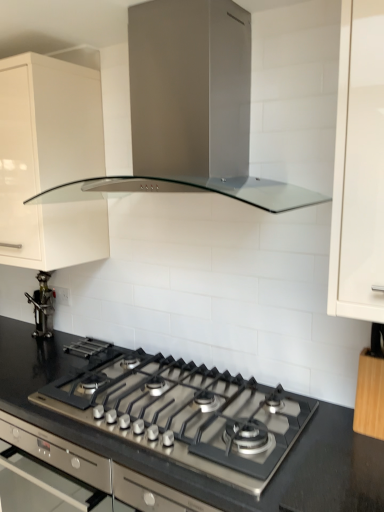
Question: Should I look upward or downward to see black granite countertop at center?

Choices:
 (A) down
 (B) up

Answer: (A)

Question: Could you tell me if satin silver oven at center is turned towards black granite countertop at center?

Choices:
 (A) yes
 (B) no

Answer: (B)

Question: Is satin silver oven at center outside of black granite countertop at center?

Choices:
 (A) no
 (B) yes

Answer: (B)

Question: Considering the relative sizes of satin silver oven at center and black granite countertop at center in the image provided, is satin silver oven at center bigger than black granite countertop at center?

Choices:
 (A) no
 (B) yes

Answer: (B)

Question: From a real-world perspective, is satin silver oven at center physically above black granite countertop at center?

Choices:
 (A) yes
 (B) no

Answer: (B)

Question: Is satin silver oven at center behind black granite countertop at center?

Choices:
 (A) yes
 (B) no

Answer: (A)

Question: Is satin silver oven at center smaller than black granite countertop at center?

Choices:
 (A) yes
 (B) no

Answer: (B)

Question: Can you confirm if metallic figurine at left is bigger than satin silver range hood at upper center?

Choices:
 (A) no
 (B) yes

Answer: (A)

Question: From the image's perspective, is metallic figurine at left below satin silver range hood at upper center?

Choices:
 (A) yes
 (B) no

Answer: (A)

Question: Is metallic figurine at left looking in the opposite direction of satin silver range hood at upper center?

Choices:
 (A) no
 (B) yes

Answer: (A)

Question: Would you say metallic figurine at left is outside satin silver range hood at upper center?

Choices:
 (A) no
 (B) yes

Answer: (B)

Question: Is the depth of metallic figurine at left greater than that of satin silver range hood at upper center?

Choices:
 (A) yes
 (B) no

Answer: (A)

Question: Does metallic figurine at left appear on the left side of satin silver range hood at upper center?

Choices:
 (A) no
 (B) yes

Answer: (B)

Question: Is black granite countertop at center not within white glossy cabinet at upper left, which is the second cabinetry from front to back?

Choices:
 (A) no
 (B) yes

Answer: (B)